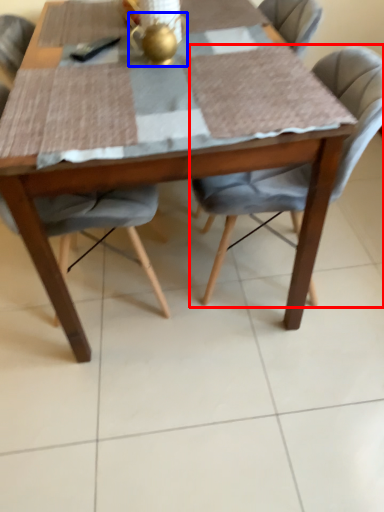
Question: Which object is closer to the camera taking this photo, chair (highlighted by a red box) or tea pot (highlighted by a blue box)?

Choices:
 (A) chair
 (B) tea pot

Answer: (A)